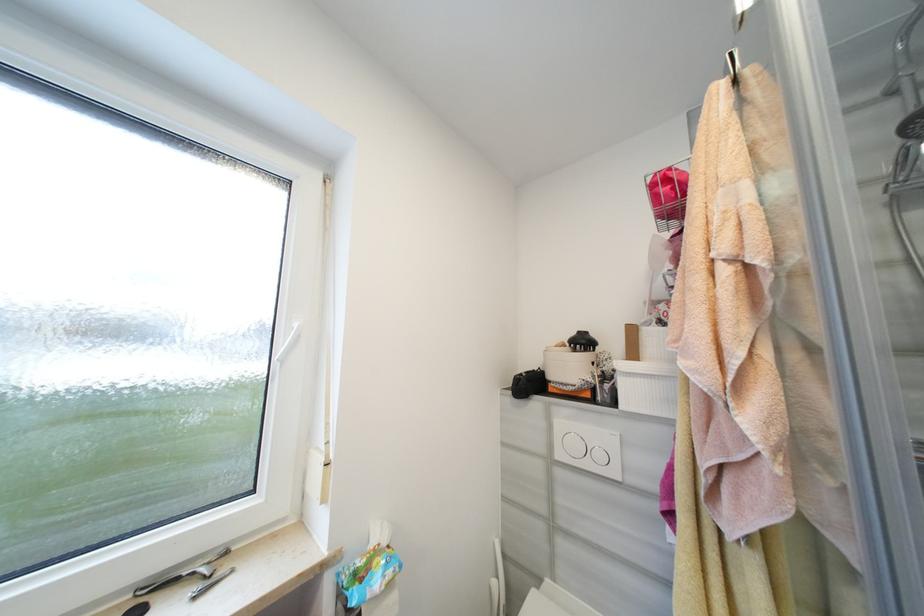
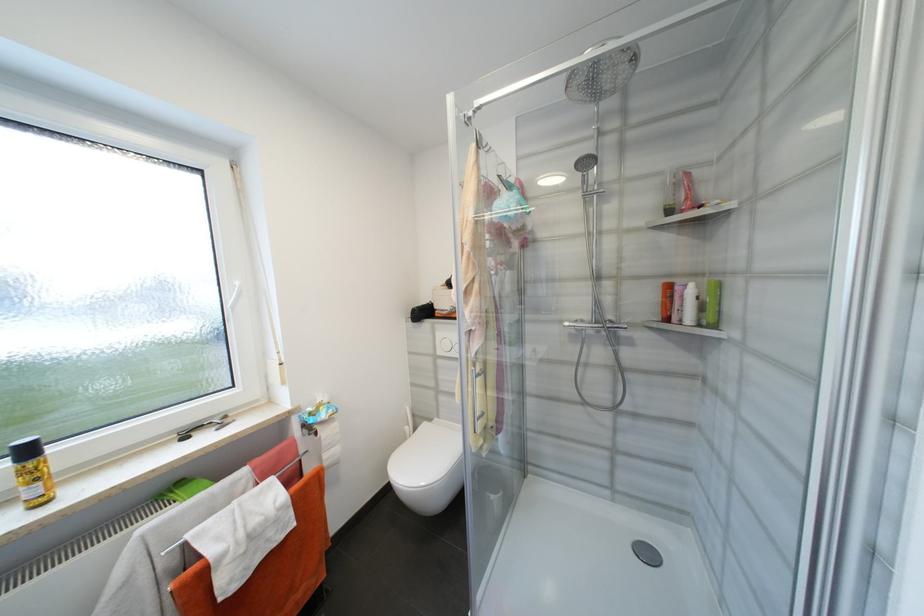
Find the pixel in the second image that matches point (565, 456) in the first image.

(445, 353)